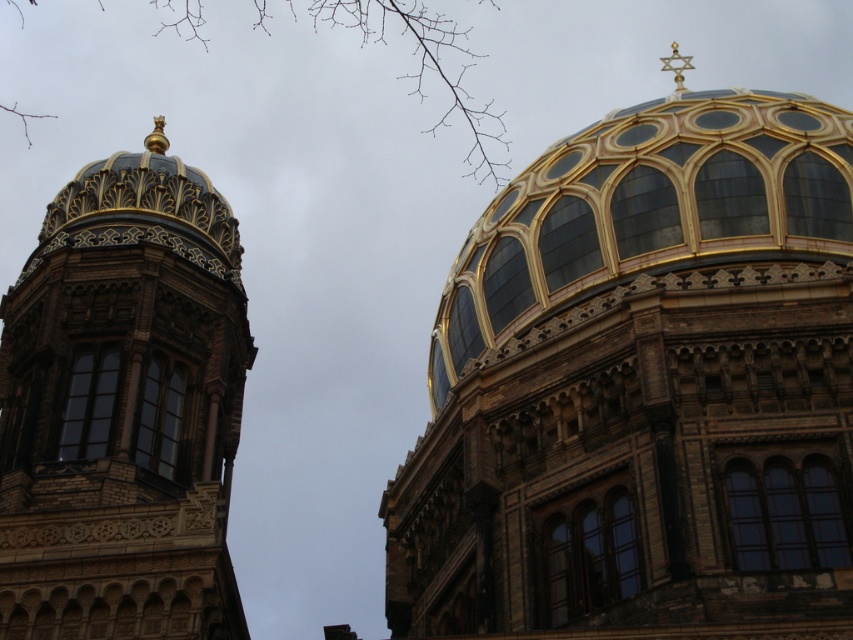
You are standing in front of the two structures. The golden glass dome at upper right has a point marked at coordinates (642, 381). Is this point closer to the edge of the dome or near its center?

The point at (642, 381) is at the golden glass dome at upper right, which is its center because the Star of David is typically placed at the top center of such domes.

You are an architect examining the image of the historic building. You need to determine the position of the golden glass dome at upper right relative to the center of the image. Is it positioned to the left or right of the center?

The golden glass dome at upper right is located at point coordinates 0.598 on the x and 0.754 on the y. Since the x coordinate is 0.598, which is greater than 0.5, it is positioned to the right of the center of the image.